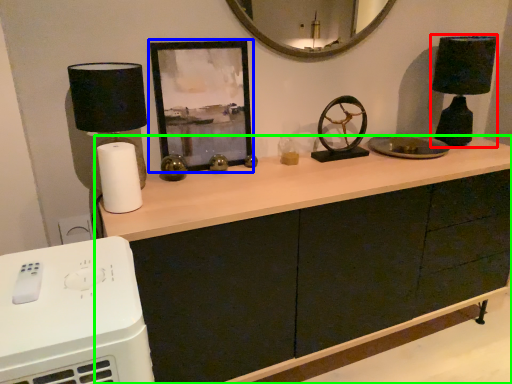
Question: Which is farther away from table lamp (highlighted by a red box)? picture frame (highlighted by a blue box) or cabinetry (highlighted by a green box)?

Choices:
 (A) picture frame
 (B) cabinetry

Answer: (A)